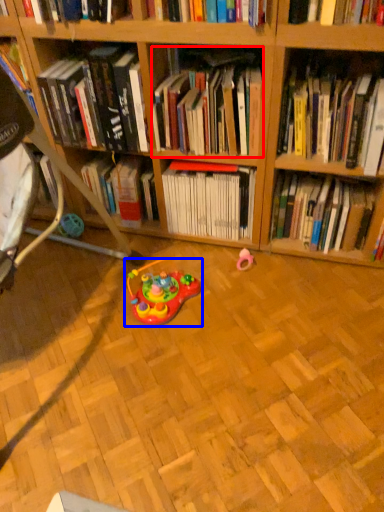
Question: Which object is closer to the camera taking this photo, book (highlighted by a red box) or toy (highlighted by a blue box)?

Choices:
 (A) book
 (B) toy

Answer: (A)